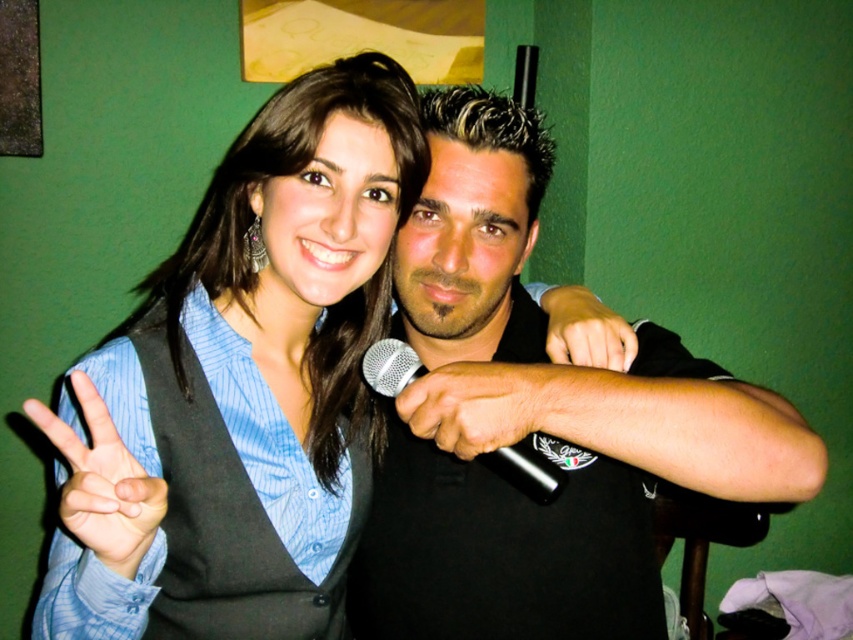
You are at a party and want to take a photo of the blue striped shirt at center and the matte black fist at center. Which object should you focus on first if you want to capture both in the same frame without moving the camera?

You should focus on the blue striped shirt at center first because it is positioned to the left of the matte black fist at center, so keeping both in frame would require starting from the left side where the blue striped shirt at center is located.

You are a photographer adjusting the framing of a photo. You need to ensure both the blue striped shirt at center and the matte black fist at center are fully visible. Which object should you prioritize keeping within the frame if space is limited?

The blue striped shirt at center should be prioritized as it is wider than the matte black fist at center, so it requires more space to be fully visible.